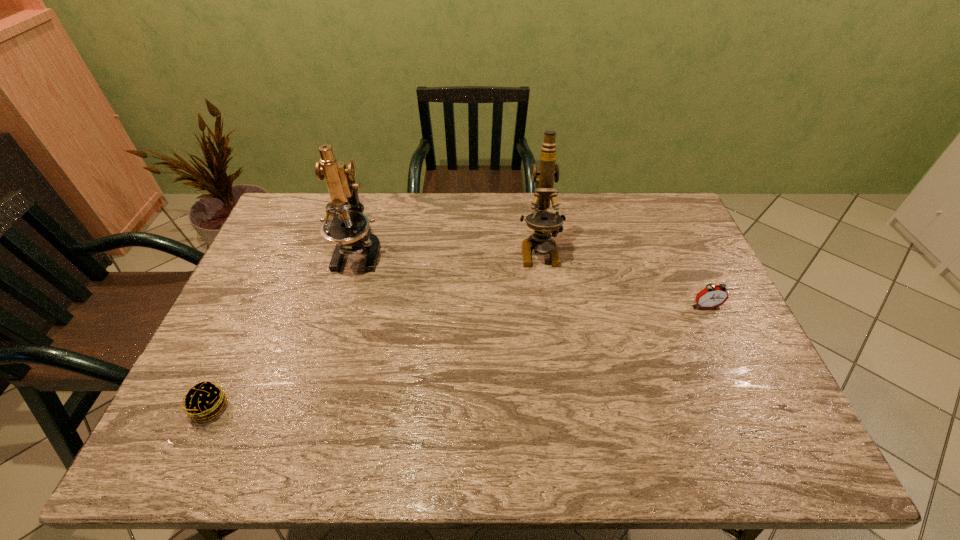
You are a GUI agent. You are given a task and a screenshot of the screen. Output one action in this format:
    pyautogui.click(x=<x>, y=<y>)
    Task: Click on the object at the left edge
    The width and height of the screenshot is (960, 540).
    Given the screenshot: What is the action you would take?
    pyautogui.click(x=204, y=400)

The width and height of the screenshot is (960, 540). I want to click on object at the right edge, so point(712,296).

Locate an element on the screen. vacant space at the far edge is located at coordinates (426, 204).

In the image, there is a desktop. Identify the location of vacant area at the near edge. pyautogui.click(x=661, y=433).

Identify the location of vacant region at the left edge of the desktop. This screenshot has height=540, width=960. (232, 349).

In the image, there is a desktop. Identify the location of vacant space at the right edge. (708, 270).

In the image, there is a desktop. In order to click on vacant space at the far left corner in this screenshot , I will do `click(296, 215)`.

In the image, there is a desktop. In order to click on vacant space at the far right corner in this screenshot , I will do `click(659, 234)`.

Where is `free space at the near right corner of the desktop`? The width and height of the screenshot is (960, 540). free space at the near right corner of the desktop is located at coordinates (789, 451).

In order to click on free area in between the third object from left to right and the leftmost object in this screenshot , I will do `click(375, 328)`.